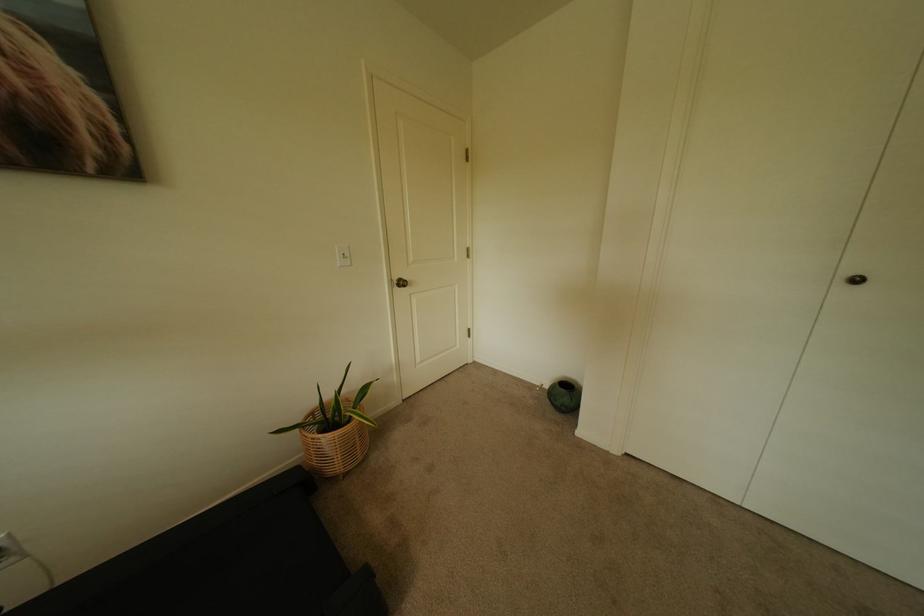
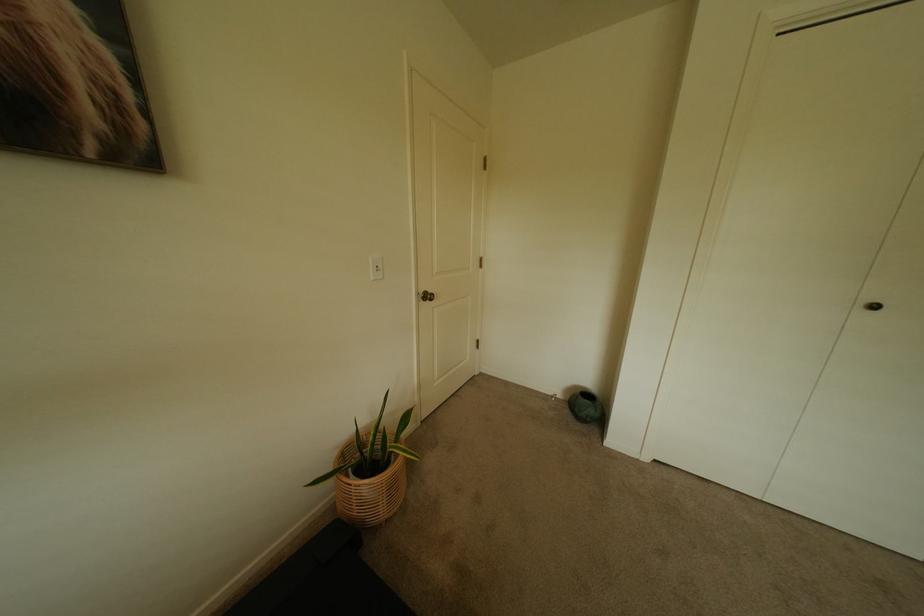
Question: Which direction would the cameraman need to move to produce the second image? Reply with the corresponding letter.

Choices:
 (A) Left
 (B) Right
 (C) Forward
 (D) Backward

Answer: (A)